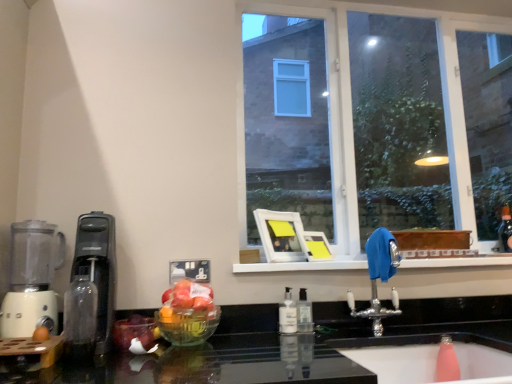
Question: Based on their positions, is clear plastic soap dispenser at center, placed as the 3th bottle when sorted from left to right, located to the left or right of clear plastic soap dispenser at center, which is the second bottle from left to right?

Choices:
 (A) left
 (B) right

Answer: (B)

Question: Looking at the image, does clear plastic soap dispenser at center, acting as the third bottle starting from the front, seem bigger or smaller compared to clear plastic soap dispenser at center, placed as the second bottle when sorted from right to left?

Choices:
 (A) small
 (B) big

Answer: (A)

Question: Which object is the closest to the white plastic blender at left?

Choices:
 (A) clear glass window at upper center
 (B) transparent glass bottle at left, the 3th bottle when ordered from back to front
 (C) pink rubber sink at lower right
 (D) silver metallic faucet at center
 (E) black plastic coffee machine at left

Answer: (E)

Question: Which of these objects is positioned closest to the clear plastic soap dispenser at center, which is the second bottle from back to front?

Choices:
 (A) pink rubber sink at lower right
 (B) silver metallic faucet at center
 (C) black glossy countertop at lower center
 (D) white plastic blender at left
 (E) clear plastic soap dispenser at center, the 1th bottle in the back-to-front sequence

Answer: (E)